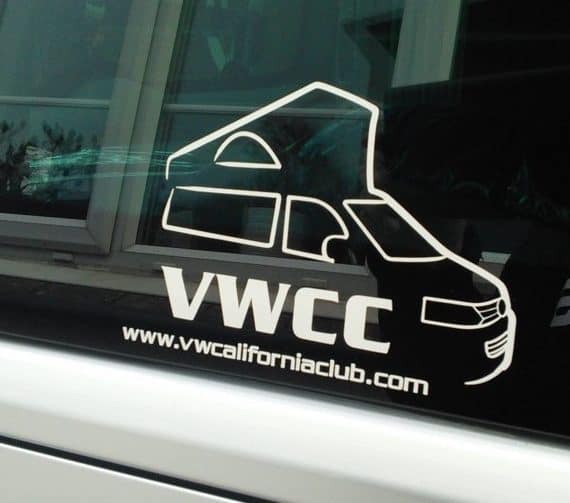
This screenshot has width=570, height=503. What are the coordinates of `reflection of window frame` in the screenshot? It's located at (434, 29), (93, 269).